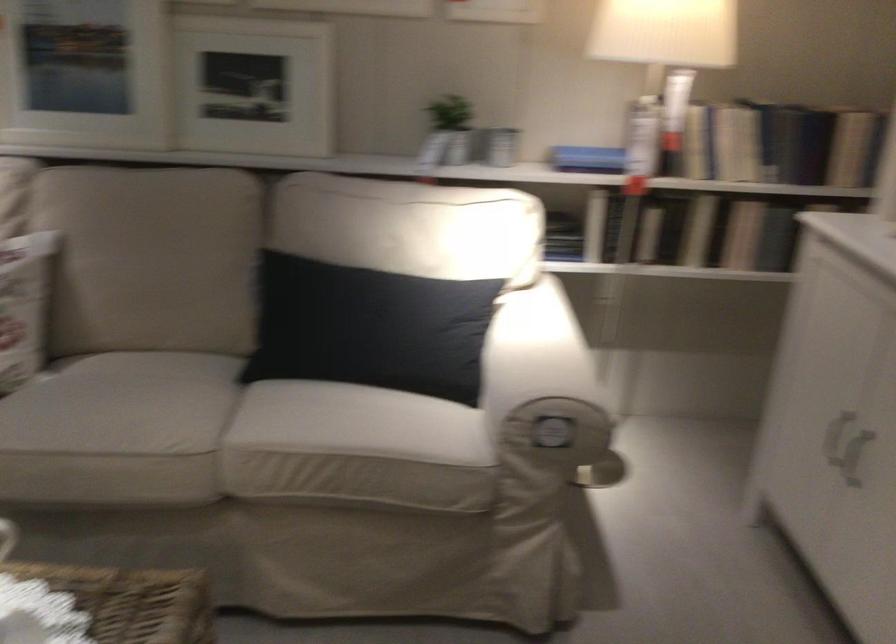
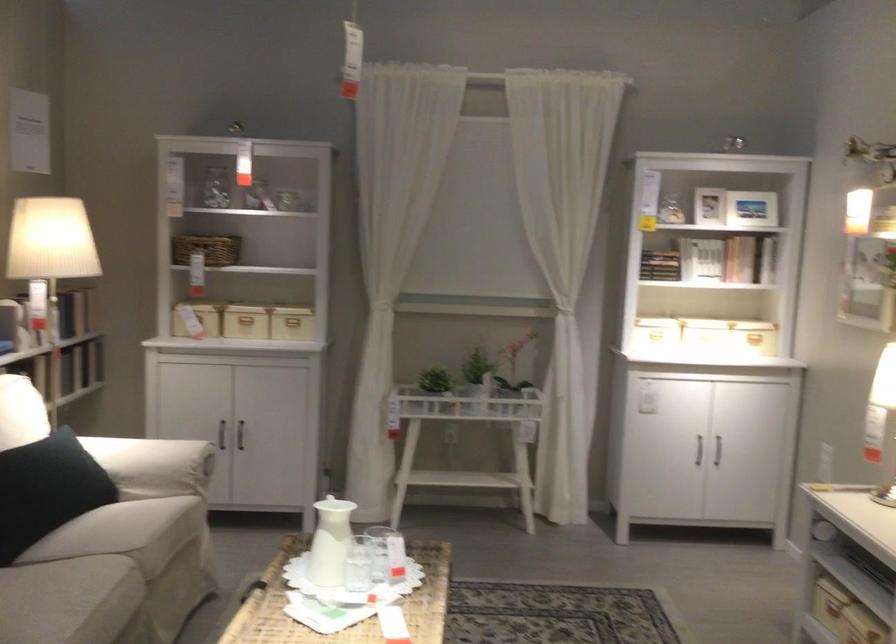
Locate, in the second image, the point that corresponds to [175,439] in the first image.

(110, 576)